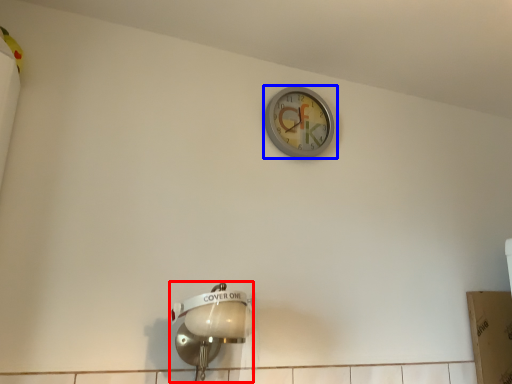
Question: Among these objects, which one is nearest to the camera, light fixture (highlighted by a red box) or wall clock (highlighted by a blue box)?

Choices:
 (A) light fixture
 (B) wall clock

Answer: (A)